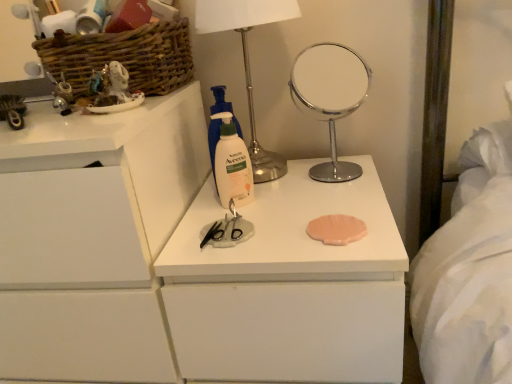
Question: From their relative heights in the image, would you say white matte chest of drawers at left, placed as the first chest of drawers when sorted from left to right, is taller or shorter than white matte chest of drawers at center, which ranks as the 1th chest of drawers in right-to-left order?

Choices:
 (A) tall
 (B) short

Answer: (A)

Question: Considering the relative positions of white matte chest of drawers at left, placed as the first chest of drawers when sorted from left to right, and white matte chest of drawers at center, positioned as the 2th chest of drawers in left-to-right order, in the image provided, is white matte chest of drawers at left, placed as the first chest of drawers when sorted from left to right, to the left or to the right of white matte chest of drawers at center, positioned as the 2th chest of drawers in left-to-right order,?

Choices:
 (A) left
 (B) right

Answer: (A)

Question: Which is farther from the white matte aveeno lotion at center?

Choices:
 (A) matte white figurine at upper left
 (B) woven brown basket at upper left
 (C) white matte chest of drawers at left, which appears as the second chest of drawers when viewed from the right
 (D) metallic silver table lamp at upper center
 (E) polished chrome mirror at center

Answer: (E)

Question: Considering the real-world distances, which object is closest to the polished chrome mirror at center?

Choices:
 (A) woven brown basket at upper left
 (B) white matte chest of drawers at left, which appears as the second chest of drawers when viewed from the right
 (C) white matte chest of drawers at center, which ranks as the 1th chest of drawers in right-to-left order
 (D) matte white figurine at upper left
 (E) white matte aveeno lotion at center

Answer: (A)